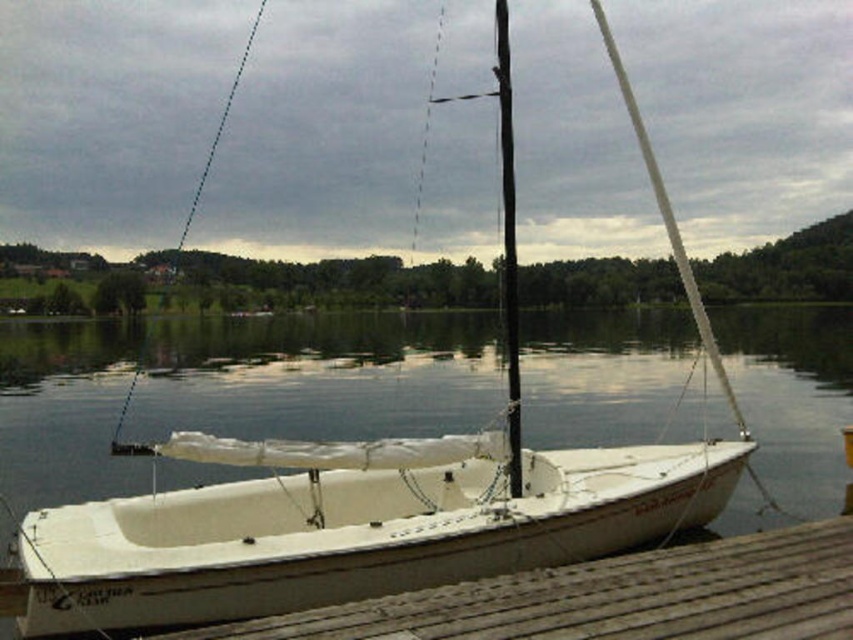
Question: Does white matte water at center have a larger size compared to wooden at lower left?

Choices:
 (A) yes
 (B) no

Answer: (A)

Question: Which of the following is the closest to the observer?

Choices:
 (A) (294, 355)
 (B) (302, 636)
 (C) (71, 605)

Answer: (B)

Question: Considering the relative positions of white matte sailboat at center and wooden at lower left in the image provided, where is white matte sailboat at center located with respect to wooden at lower left?

Choices:
 (A) above
 (B) below

Answer: (A)

Question: Which object appears farthest from the camera in this image?

Choices:
 (A) wooden at lower left
 (B) white matte water at center

Answer: (B)

Question: Which point is farther to the camera?

Choices:
 (A) (424, 616)
 (B) (320, 433)

Answer: (B)

Question: From the image, what is the correct spatial relationship of white matte sailboat at center in relation to wooden at lower left?

Choices:
 (A) right
 (B) left

Answer: (B)